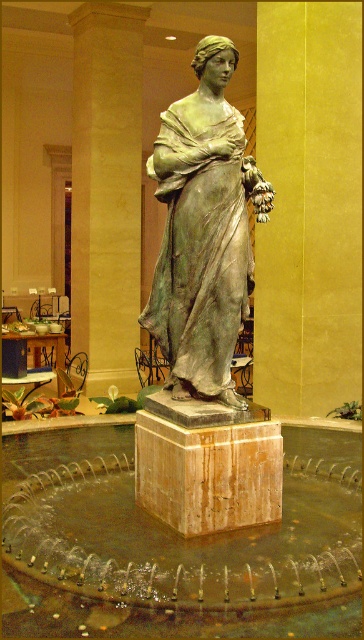
Is point (203, 113) positioned behind point (91, 172)?

No, it is in front of (91, 172).

Is green patina statue at center in front of green marble pillar at center?

Yes.

Identify the location of green patina statue at center. This screenshot has width=364, height=640. (203, 230).